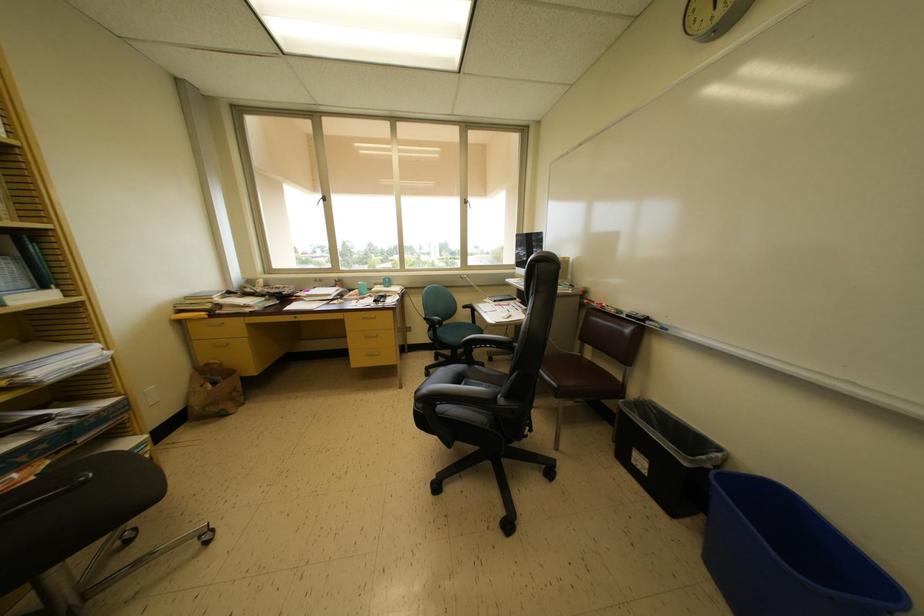
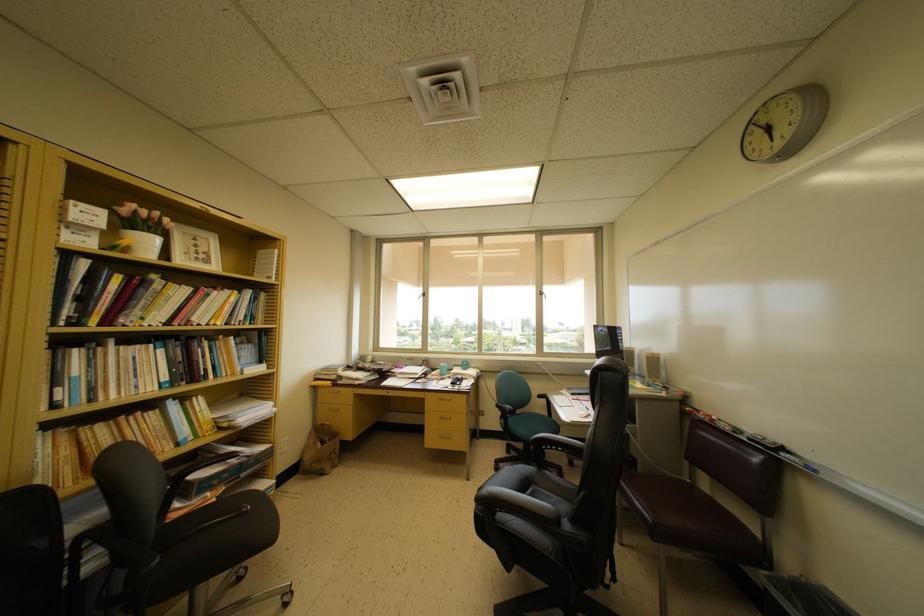
In the second image, find the point that corresponds to point 638,317 in the first image.

(762, 440)